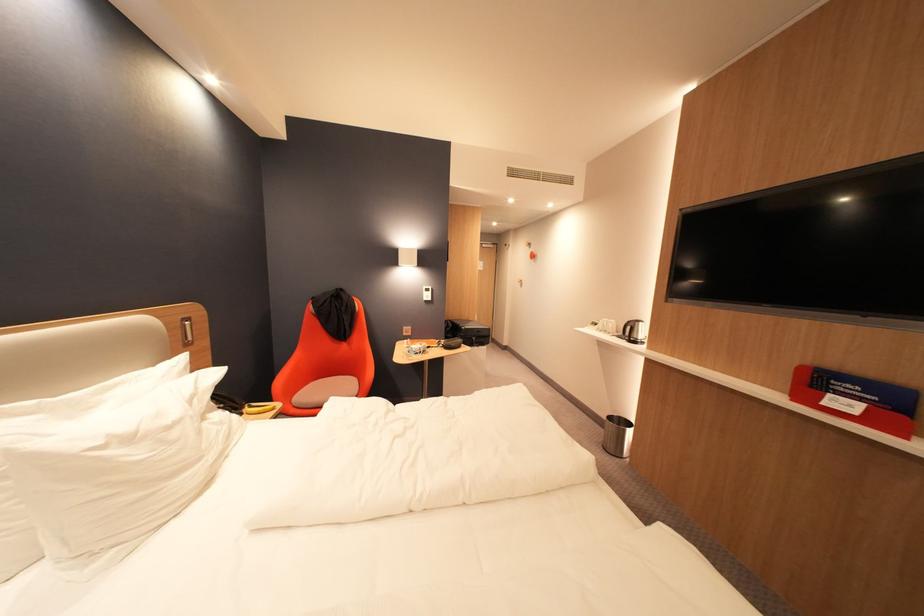
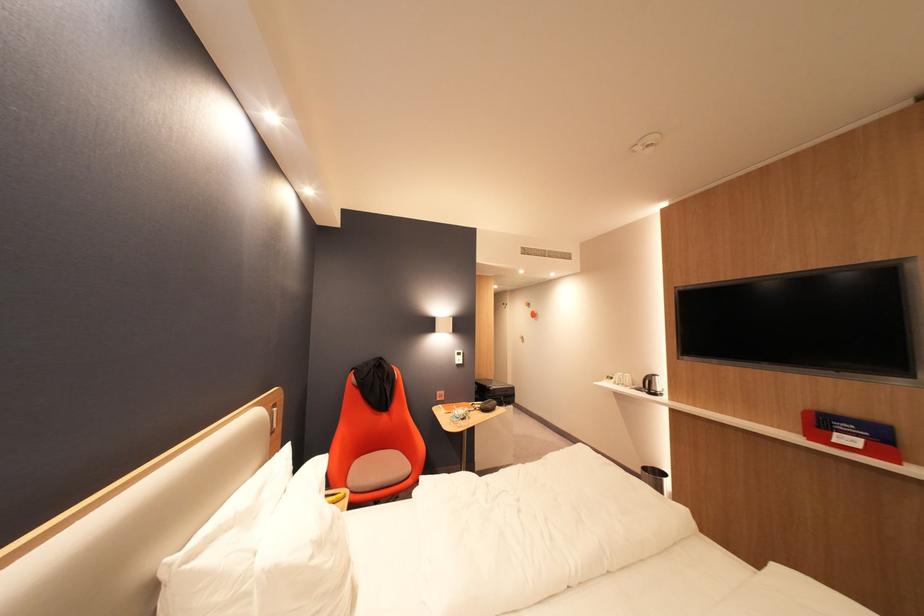
Locate, in the second image, the point that corresponds to the point at 139,440 in the first image.

(330, 545)